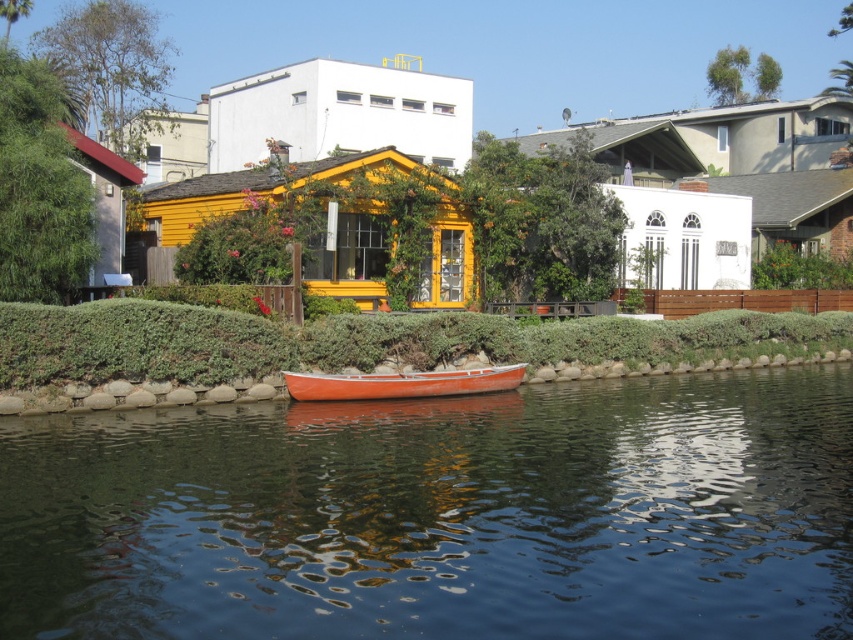
Between glossy orange boat at center and orange wood canoe at center, which one appears on the left side from the viewer's perspective?

Positioned to the left is orange wood canoe at center.

Is glossy orange boat at center in front of orange wood canoe at center?

Yes, glossy orange boat at center is closer to the viewer.

Who is more forward, (637, 616) or (515, 369)?

Point (637, 616) is more forward.

Where is `glossy orange boat at center`? This screenshot has height=640, width=853. glossy orange boat at center is located at coordinates (442, 515).